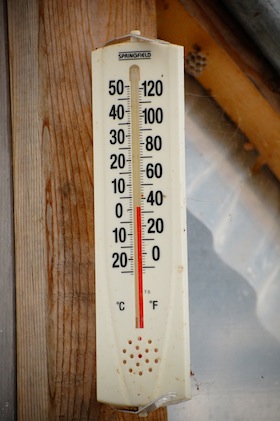
Where is `small metal hook`? small metal hook is located at coordinates (146, 39).